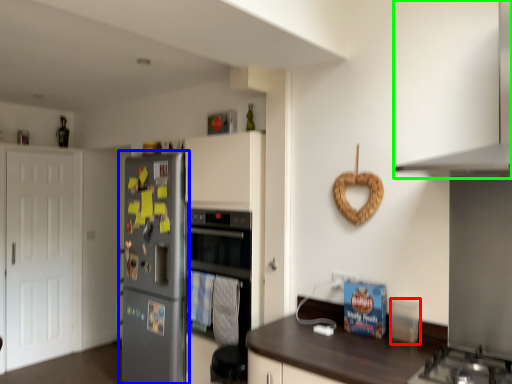
Question: Which is nearer to the appliance (highlighted by a red box)? refrigerator (highlighted by a blue box) or exhaust hood (highlighted by a green box).

Choices:
 (A) refrigerator
 (B) exhaust hood

Answer: (B)